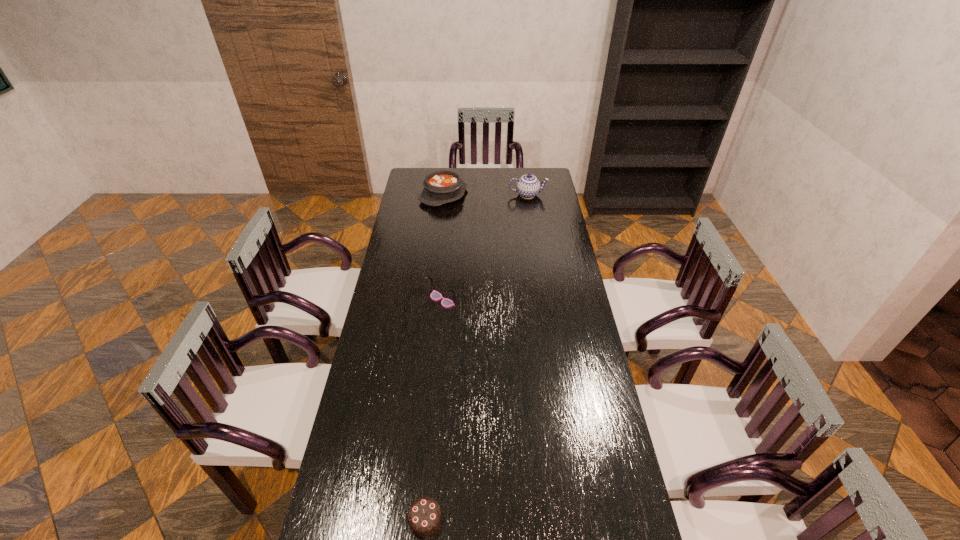
At what (x,y) coordinates should I click in order to perform the action: click on chinaware present at the far edge. Please return your answer as a coordinate pair (x, y). Image resolution: width=960 pixels, height=540 pixels. Looking at the image, I should click on (528, 186).

This screenshot has width=960, height=540. Find the location of `casserole located in the far edge section of the desktop`. casserole located in the far edge section of the desktop is located at coordinates (443, 186).

Find the location of `object located in the left edge section of the desktop`. object located in the left edge section of the desktop is located at coordinates (443, 186).

This screenshot has width=960, height=540. What are the coordinates of `object that is at the right edge` in the screenshot? It's located at (528, 186).

This screenshot has height=540, width=960. In order to click on object at the far left corner in this screenshot , I will do `click(443, 186)`.

You are a GUI agent. You are given a task and a screenshot of the screen. Output one action in this format:
    pyautogui.click(x=<x>, y=<y>)
    Task: Click on the object present at the far right corner
    The width and height of the screenshot is (960, 540).
    Given the screenshot: What is the action you would take?
    pyautogui.click(x=528, y=186)

Where is `free space at the far edge of the desktop`? The width and height of the screenshot is (960, 540). free space at the far edge of the desktop is located at coordinates (469, 171).

Identify the location of free space at the left edge of the desktop. This screenshot has width=960, height=540. [384, 467].

Where is `vacant space at the right edge of the desktop`? Image resolution: width=960 pixels, height=540 pixels. vacant space at the right edge of the desktop is located at coordinates pos(574,402).

You are a GUI agent. You are given a task and a screenshot of the screen. Output one action in this format:
    pyautogui.click(x=<x>, y=<y>)
    Task: Click on the vacant area at the far left corner of the desktop
    The height and width of the screenshot is (540, 960).
    Given the screenshot: What is the action you would take?
    pyautogui.click(x=408, y=173)